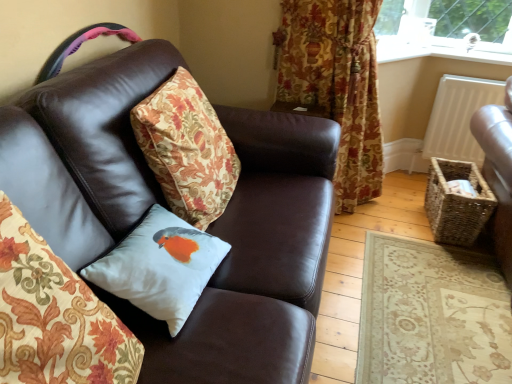
Question: From a real-world perspective, is white matte radiator at upper right positioned over white satin cushion at center, placed as the second pillow when sorted from back to front, based on gravity?

Choices:
 (A) no
 (B) yes

Answer: (A)

Question: Is white satin cushion at center, placed as the second pillow when sorted from back to front, completely or partially inside white matte radiator at upper right?

Choices:
 (A) yes
 (B) no

Answer: (B)

Question: Is white matte radiator at upper right looking in the opposite direction of white satin cushion at center, placed as the second pillow when sorted from back to front?

Choices:
 (A) yes
 (B) no

Answer: (B)

Question: Is white matte radiator at upper right at the right side of white satin cushion at center, placed as the second pillow when sorted from back to front?

Choices:
 (A) no
 (B) yes

Answer: (B)

Question: From the image's perspective, would you say white matte radiator at upper right is shown under white satin cushion at center, placed as the second pillow when sorted from back to front?

Choices:
 (A) yes
 (B) no

Answer: (B)

Question: Is white matte radiator at upper right closer to the viewer compared to white satin cushion at center, placed as the second pillow when sorted from back to front?

Choices:
 (A) no
 (B) yes

Answer: (A)

Question: Can you confirm if white satin cushion with bird at center, placed as the 2th pillow when sorted from front to back, is wider than white matte radiator at upper right?

Choices:
 (A) no
 (B) yes

Answer: (B)

Question: From a real-world perspective, does white satin cushion with bird at center, placed as the 2th pillow when sorted from front to back, sit lower than white matte radiator at upper right?

Choices:
 (A) yes
 (B) no

Answer: (B)

Question: Considering the relative sizes of white satin cushion with bird at center, placed as the 2th pillow when sorted from front to back, and white matte radiator at upper right in the image provided, is white satin cushion with bird at center, placed as the 2th pillow when sorted from front to back, bigger than white matte radiator at upper right?

Choices:
 (A) yes
 (B) no

Answer: (B)

Question: Is white matte radiator at upper right surrounded by white satin cushion with bird at center, placed as the 2th pillow when sorted from front to back?

Choices:
 (A) no
 (B) yes

Answer: (A)

Question: Is white satin cushion with bird at center, acting as the first pillow starting from the back, next to white matte radiator at upper right?

Choices:
 (A) yes
 (B) no

Answer: (B)

Question: From the image's perspective, is white satin cushion with bird at center, acting as the first pillow starting from the back, located above white matte radiator at upper right?

Choices:
 (A) yes
 (B) no

Answer: (B)

Question: Is white matte radiator at upper right touching floral fabric curtain at upper right?

Choices:
 (A) yes
 (B) no

Answer: (B)